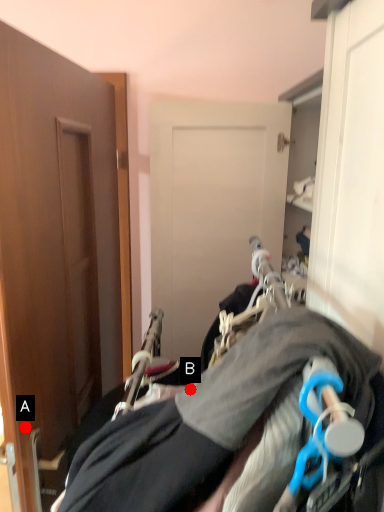
Question: Two points are circled on the image, labeled by A and B beside each circle. Which point is closer to the camera?

Choices:
 (A) A is closer
 (B) B is closer

Answer: (B)